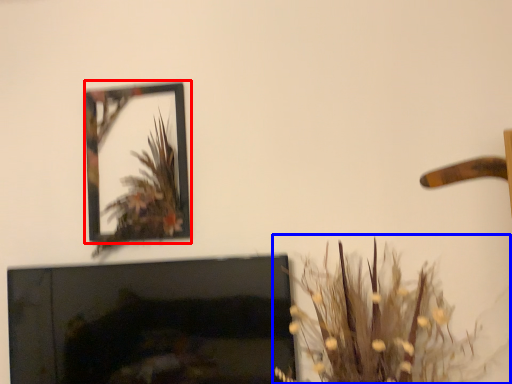
Question: Which of the following is the farthest to the observer, picture frame (highlighted by a red box) or houseplant (highlighted by a blue box)?

Choices:
 (A) picture frame
 (B) houseplant

Answer: (A)